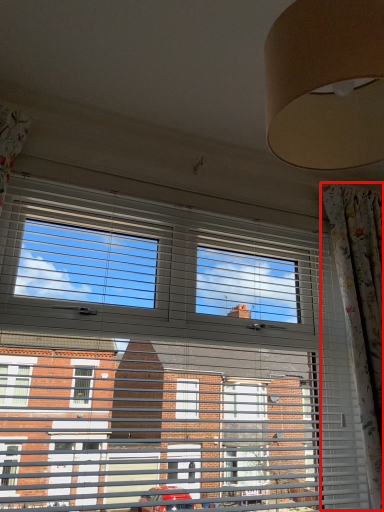
Question: In this image, where is curtain (annotated by the red box) located relative to window?

Choices:
 (A) left
 (B) right

Answer: (B)